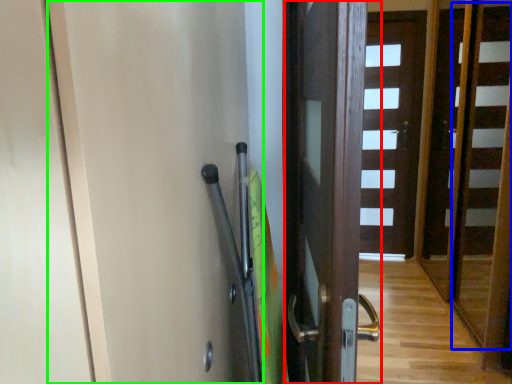
Question: Which object is the closest to the door (highlighted by a red box)? Choose among these: stair (highlighted by a blue box) or screen door (highlighted by a green box).

Choices:
 (A) stair
 (B) screen door

Answer: (B)